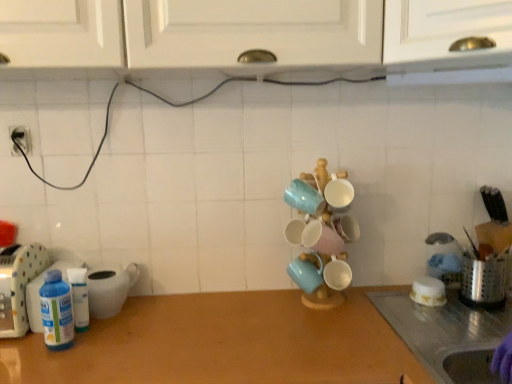
Identify the location of free space in front of matte blue mug at center, the first tableware viewed from the left. (311, 335).